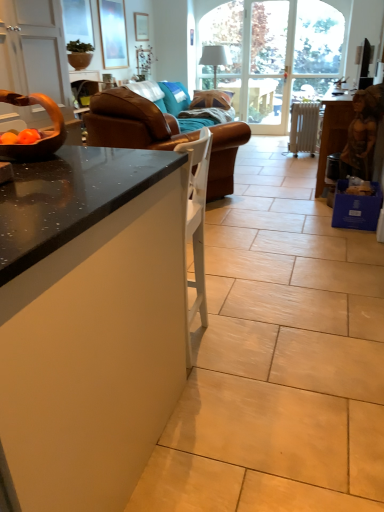
The height and width of the screenshot is (512, 384). I want to click on vacant space that is to the left of blue cardboard box at lower right, so click(x=313, y=218).